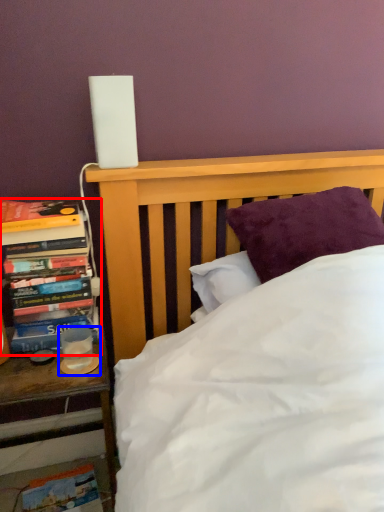
Question: Among these objects, which one is farthest to the camera, book (highlighted by a red box) or candle holder (highlighted by a blue box)?

Choices:
 (A) book
 (B) candle holder

Answer: (B)